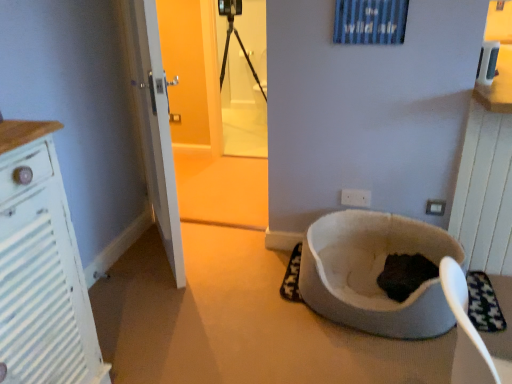
What do you see at coordinates (41, 267) in the screenshot? The width and height of the screenshot is (512, 384). I see `white textured cabinet at left` at bounding box center [41, 267].

Locate an element on the screen. This screenshot has height=384, width=512. white plastic electric outlet at lower right, placed as the 2th electric outlet when sorted from back to front is located at coordinates (435, 207).

Locate an element on the screen. This screenshot has width=512, height=384. transparent plastic screen door at upper center is located at coordinates (243, 77).

At what (x,y) coordinates should I click in order to perform the action: click on white fabric cat bed at lower right. Please return your answer as a coordinate pair (x, y). Image resolution: width=512 pixels, height=384 pixels. Looking at the image, I should click on (374, 273).

This screenshot has height=384, width=512. What do you see at coordinates (374, 273) in the screenshot?
I see `white fabric cat bed at lower right` at bounding box center [374, 273].

The image size is (512, 384). What are the coordinates of `white textured cabinet at left` in the screenshot? It's located at (41, 267).

Between point (364, 207) and point (405, 327), which one is positioned in front?

The point (405, 327) is more forward.

Who is shorter, white plastic electric outlet at center, marked as the 1th electric outlet in a left-to-right arrangement, or white fabric cat bed at lower right?

With less height is white plastic electric outlet at center, marked as the 1th electric outlet in a left-to-right arrangement.

What's the angular difference between white plastic electric outlet at center, which appears as the second electric outlet when viewed from the right, and white fabric cat bed at lower right's facing directions?

white plastic electric outlet at center, which appears as the second electric outlet when viewed from the right, and white fabric cat bed at lower right are facing 175 degrees away from each other.

How much distance is there between white plastic electric outlet at center, positioned as the 1th electric outlet in back-to-front order, and white fabric cat bed at lower right?

The distance of white plastic electric outlet at center, positioned as the 1th electric outlet in back-to-front order, from white fabric cat bed at lower right is 14.75 inches.

Which object is positioned more to the right, white fabric cat bed at lower right or white textured cabinet at left?

white fabric cat bed at lower right.

Considering the positions of objects white fabric cat bed at lower right and white textured cabinet at left in the image provided, who is behind, white fabric cat bed at lower right or white textured cabinet at left?

white fabric cat bed at lower right is behind.

Is the surface of white fabric cat bed at lower right in direct contact with white textured cabinet at left?

There is a gap between white fabric cat bed at lower right and white textured cabinet at left.

At what (x,y) coordinates should I click in order to perform the action: click on cabinetry positioned vertically above the white fabric cat bed at lower right (from a real-world perspective). Please return your answer as a coordinate pair (x, y). Looking at the image, I should click on (41, 267).

From a real-world perspective, which is physically below, transparent plastic screen door at upper center or white plastic electric outlet at center, positioned as the 1th electric outlet in back-to-front order?

white plastic electric outlet at center, positioned as the 1th electric outlet in back-to-front order, from a real-world perspective.

Is transparent plastic screen door at upper center turned away from white plastic electric outlet at center, positioned as the 1th electric outlet in back-to-front order?

transparent plastic screen door at upper center is not turned away from white plastic electric outlet at center, positioned as the 1th electric outlet in back-to-front order.

Which object is thinner, transparent plastic screen door at upper center or white plastic electric outlet at center, which appears as the second electric outlet when viewed from the right?

white plastic electric outlet at center, which appears as the second electric outlet when viewed from the right.

How many degrees apart are the facing directions of transparent plastic screen door at upper center and white plastic electric outlet at center, which ranks as the 2th electric outlet in front-to-back order?

0.425 degrees separate the facing orientations of transparent plastic screen door at upper center and white plastic electric outlet at center, which ranks as the 2th electric outlet in front-to-back order.

Is white plastic electric outlet at lower right, positioned as the 1th electric outlet in right-to-left order, surrounding white plastic electric outlet at center, marked as the 1th electric outlet in a left-to-right arrangement?

No.

From the image's perspective, is white plastic electric outlet at lower right, marked as the first electric outlet in a front-to-back arrangement, beneath white plastic electric outlet at center, which appears as the second electric outlet when viewed from the right?

Yes, from the image's perspective, white plastic electric outlet at lower right, marked as the first electric outlet in a front-to-back arrangement, is beneath white plastic electric outlet at center, which appears as the second electric outlet when viewed from the right.

Find the location of a particular element. electric outlet below the white plastic electric outlet at center, which appears as the second electric outlet when viewed from the right (from a real-world perspective) is located at coordinates (435, 207).

From a real-world perspective, which is physically above, white plastic electric outlet at lower right, placed as the 2th electric outlet when sorted from left to right, or white plastic electric outlet at center, marked as the 1th electric outlet in a left-to-right arrangement?

white plastic electric outlet at center, marked as the 1th electric outlet in a left-to-right arrangement.

Considering the relative positions of white plastic electric outlet at center, positioned as the 1th electric outlet in back-to-front order, and transparent plastic screen door at upper center in the image provided, is white plastic electric outlet at center, positioned as the 1th electric outlet in back-to-front order, behind transparent plastic screen door at upper center?

That is False.

Considering the positions of point (365, 206) and point (263, 145), is point (365, 206) closer or farther from the camera than point (263, 145)?

Point (365, 206) appears to be closer to the viewer than point (263, 145).

Is white plastic electric outlet at center, marked as the 1th electric outlet in a left-to-right arrangement, beside transparent plastic screen door at upper center?

No, white plastic electric outlet at center, marked as the 1th electric outlet in a left-to-right arrangement, is not beside transparent plastic screen door at upper center.

Can you confirm if white plastic electric outlet at center, which appears as the second electric outlet when viewed from the right, is positioned to the left of transparent plastic screen door at upper center?

No, white plastic electric outlet at center, which appears as the second electric outlet when viewed from the right, is not to the left of transparent plastic screen door at upper center.

Which is behind, point (324, 235) or point (436, 208)?

The point (324, 235) is farther.

Is white fabric cat bed at lower right at the left side of white plastic electric outlet at lower right, placed as the 2th electric outlet when sorted from left to right?

Correct, you'll find white fabric cat bed at lower right to the left of white plastic electric outlet at lower right, placed as the 2th electric outlet when sorted from left to right.

Considering the sizes of white fabric cat bed at lower right and white plastic electric outlet at lower right, placed as the 2th electric outlet when sorted from back to front, in the image, is white fabric cat bed at lower right wider or thinner than white plastic electric outlet at lower right, placed as the 2th electric outlet when sorted from back to front,?

white fabric cat bed at lower right is wider than white plastic electric outlet at lower right, placed as the 2th electric outlet when sorted from back to front.

Which of these two, white textured cabinet at left or transparent plastic screen door at upper center, is wider?

Wider between the two is white textured cabinet at left.

Is white textured cabinet at left situated inside transparent plastic screen door at upper center or outside?

white textured cabinet at left lies outside transparent plastic screen door at upper center.

Based on the photo, from a real-world perspective, is white textured cabinet at left located beneath transparent plastic screen door at upper center?

Yes, from a real-world perspective, white textured cabinet at left is beneath transparent plastic screen door at upper center.

Does point (94, 348) come closer to viewer compared to point (224, 79)?

Yes, it is.

Locate an element on the screen. The height and width of the screenshot is (384, 512). toilet bowl on the right of the white plastic electric outlet at center, which appears as the second electric outlet when viewed from the right is located at coordinates (374, 273).

This screenshot has width=512, height=384. Find the location of `cabinetry lying in front of the white fabric cat bed at lower right`. cabinetry lying in front of the white fabric cat bed at lower right is located at coordinates (41, 267).

Which object lies nearer to the anchor point white plastic electric outlet at center, positioned as the 1th electric outlet in back-to-front order, white textured cabinet at left or white plastic electric outlet at lower right, placed as the 2th electric outlet when sorted from back to front?

white plastic electric outlet at lower right, placed as the 2th electric outlet when sorted from back to front.

Based on their spatial positions, is white fabric cat bed at lower right or white plastic electric outlet at center, positioned as the 1th electric outlet in back-to-front order, closer to white plastic electric outlet at lower right, placed as the 2th electric outlet when sorted from back to front?

The object closer to white plastic electric outlet at lower right, placed as the 2th electric outlet when sorted from back to front, is white plastic electric outlet at center, positioned as the 1th electric outlet in back-to-front order.

Based on their spatial positions, is white fabric cat bed at lower right or white plastic electric outlet at center, marked as the 1th electric outlet in a left-to-right arrangement, closer to transparent plastic screen door at upper center?

The object closer to transparent plastic screen door at upper center is white fabric cat bed at lower right.

Considering their positions, is white plastic electric outlet at center, positioned as the 1th electric outlet in back-to-front order, positioned further to white fabric cat bed at lower right than white textured cabinet at left?

white textured cabinet at left.

Considering their positions, is white plastic electric outlet at lower right, positioned as the 1th electric outlet in right-to-left order, positioned closer to white fabric cat bed at lower right than white plastic electric outlet at center, marked as the 1th electric outlet in a left-to-right arrangement?

white plastic electric outlet at center, marked as the 1th electric outlet in a left-to-right arrangement, is positioned closer to the anchor white fabric cat bed at lower right.

When comparing their distances from white plastic electric outlet at center, positioned as the 1th electric outlet in back-to-front order, does white plastic electric outlet at lower right, placed as the 2th electric outlet when sorted from left to right, or transparent plastic screen door at upper center seem closer?

white plastic electric outlet at lower right, placed as the 2th electric outlet when sorted from left to right, lies closer to white plastic electric outlet at center, positioned as the 1th electric outlet in back-to-front order, than the other object.

When comparing their distances from white plastic electric outlet at center, positioned as the 1th electric outlet in back-to-front order, does white plastic electric outlet at lower right, marked as the first electric outlet in a front-to-back arrangement, or white textured cabinet at left seem further?

The object further to white plastic electric outlet at center, positioned as the 1th electric outlet in back-to-front order, is white textured cabinet at left.

From the image, which object appears to be farther from transparent plastic screen door at upper center, white textured cabinet at left or white plastic electric outlet at center, which appears as the second electric outlet when viewed from the right?

white textured cabinet at left.

At what (x,y) coordinates should I click in order to perform the action: click on electric outlet between white textured cabinet at left and white plastic electric outlet at lower right, placed as the 2th electric outlet when sorted from back to front, in the horizontal direction. Please return your answer as a coordinate pair (x, y). Looking at the image, I should click on (356, 198).

At what (x,y) coordinates should I click in order to perform the action: click on electric outlet between white fabric cat bed at lower right and white plastic electric outlet at center, positioned as the 1th electric outlet in back-to-front order, from front to back. Please return your answer as a coordinate pair (x, y). The width and height of the screenshot is (512, 384). Looking at the image, I should click on (435, 207).

Locate an element on the screen. toilet bowl located between white textured cabinet at left and transparent plastic screen door at upper center in the depth direction is located at coordinates (374, 273).

The height and width of the screenshot is (384, 512). I want to click on electric outlet between white plastic electric outlet at lower right, marked as the first electric outlet in a front-to-back arrangement, and transparent plastic screen door at upper center, along the z-axis, so click(x=356, y=198).